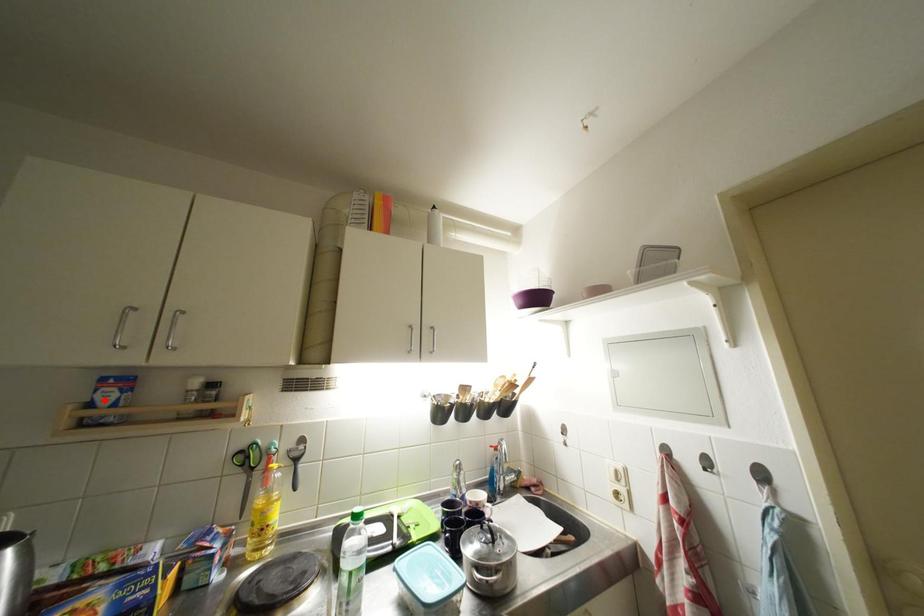
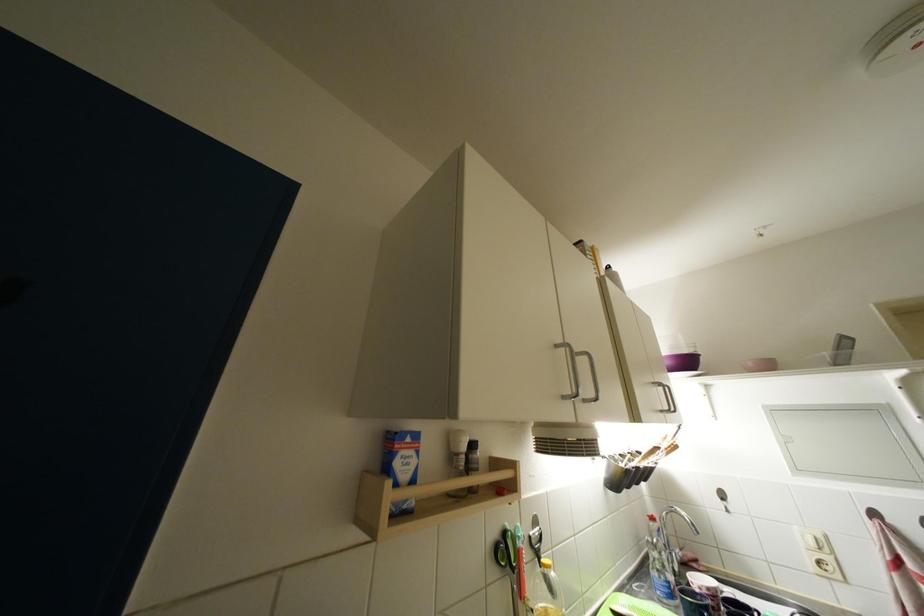
In the second image, find the point that corresponds to the highlighted location in the first image.

(404, 467)